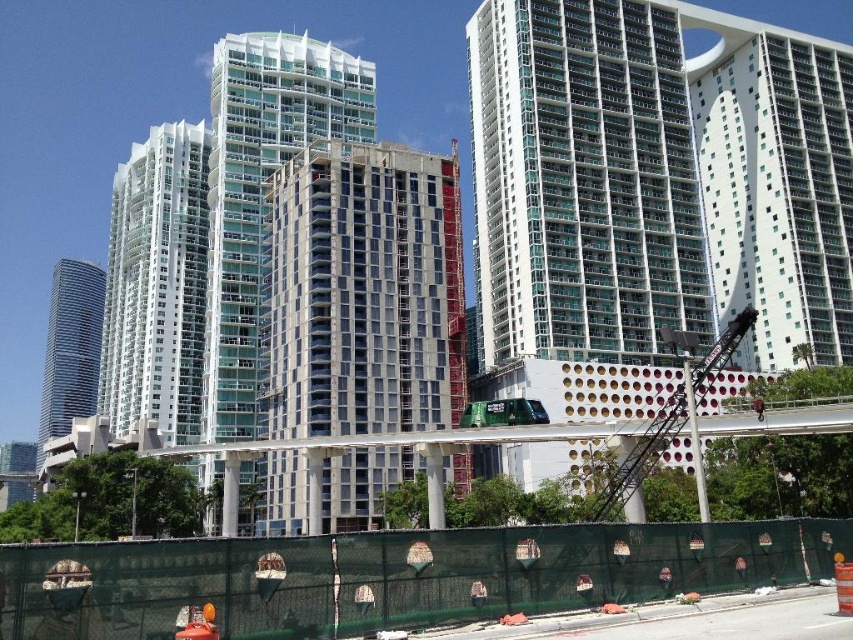
You are standing at the crane on the right side of the construction site. You need to walk to the point marked at coordinates point (393, 577). Which direction should you go to reach it?

The point (393, 577) is located on the green mesh fence at lower center, so you should move towards the lower center direction from the crane on the right side to reach it.

You are a delivery truck driver who needs to park your truck near the green mesh fence at lower center without blocking the entrance to the white concrete building at center. The truck requires a minimum of 40 meters of clearance to the building. Can you safely park your truck there?

The green mesh fence at lower center is 39.52 meters away from the white concrete building at center. Since the truck requires a minimum of 40 meters of clearance, parking there would not provide enough space, so it is not safe to park the truck there.

You are a city planner reviewing this construction site. You need to determine if the green mesh fence at lower center can be moved closer to the glassy concrete building at center without overlapping. Based on their current spatial relationship, is this possible?

The green mesh fence at lower center occupies less space than the glassy concrete building at center, so it is possible to move the green mesh fence at lower center closer to the glassy concrete building at center without overlapping as long as the total space they occupy together does not exceed the available area.